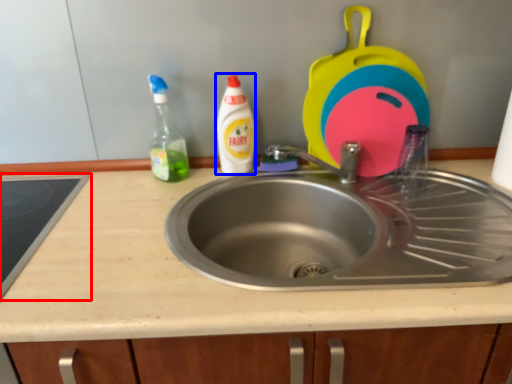
Question: Which object is further to the camera taking this photo, appliance (highlighted by a red box) or cleaning product (highlighted by a blue box)?

Choices:
 (A) appliance
 (B) cleaning product

Answer: (B)